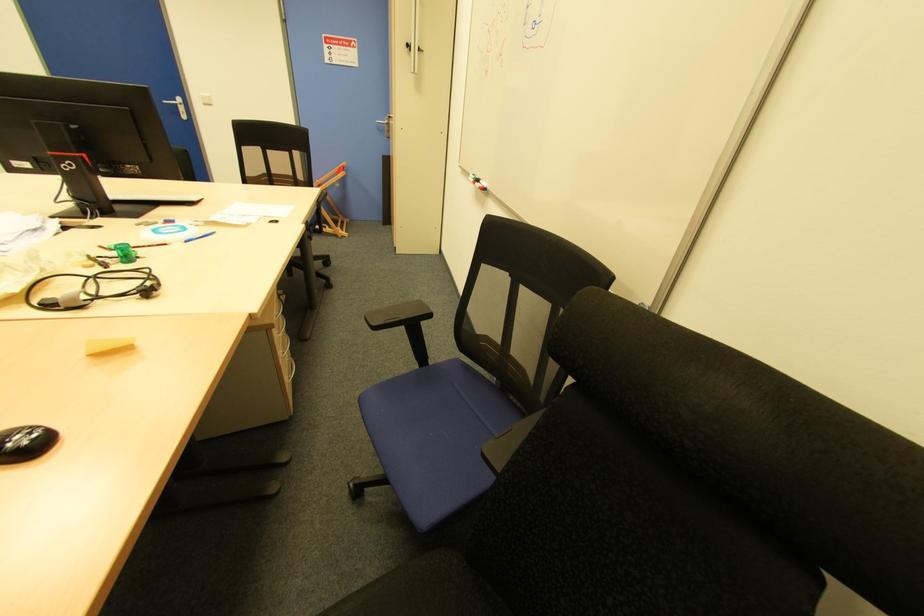
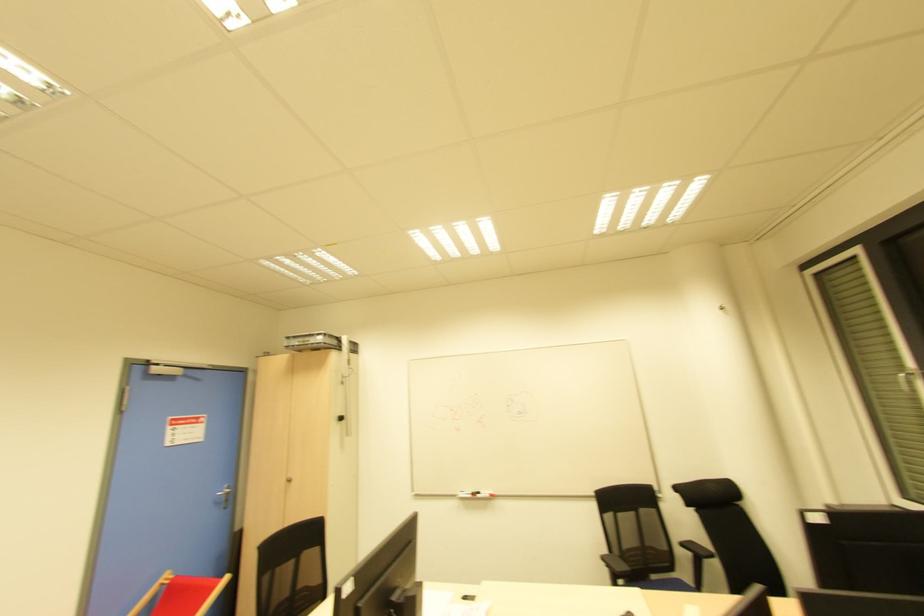
Locate, in the second image, the point that corresponds to point 483,192 in the first image.

(492, 496)